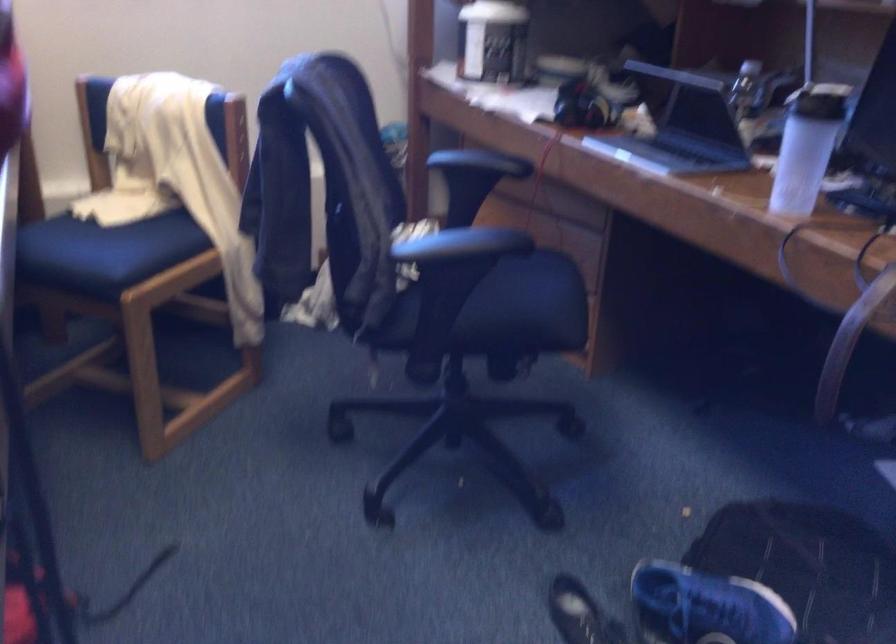
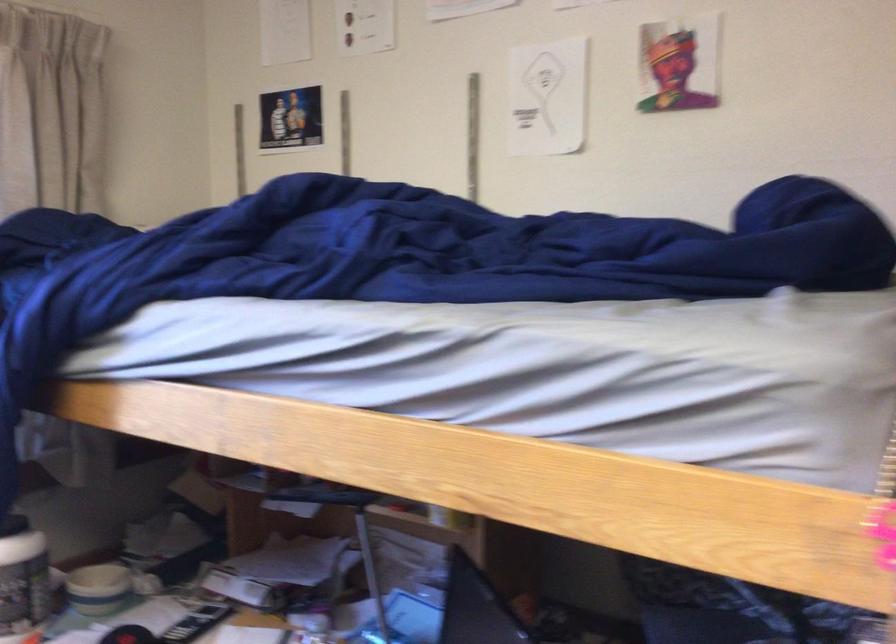
Locate, in the second image, the point that corresponds to (x=558, y=67) in the first image.

(98, 589)